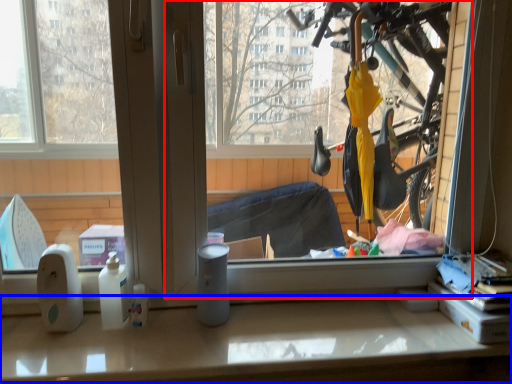
Question: Among these objects, which one is farthest to the camera, window screen (highlighted by a red box) or counter top (highlighted by a blue box)?

Choices:
 (A) window screen
 (B) counter top

Answer: (B)